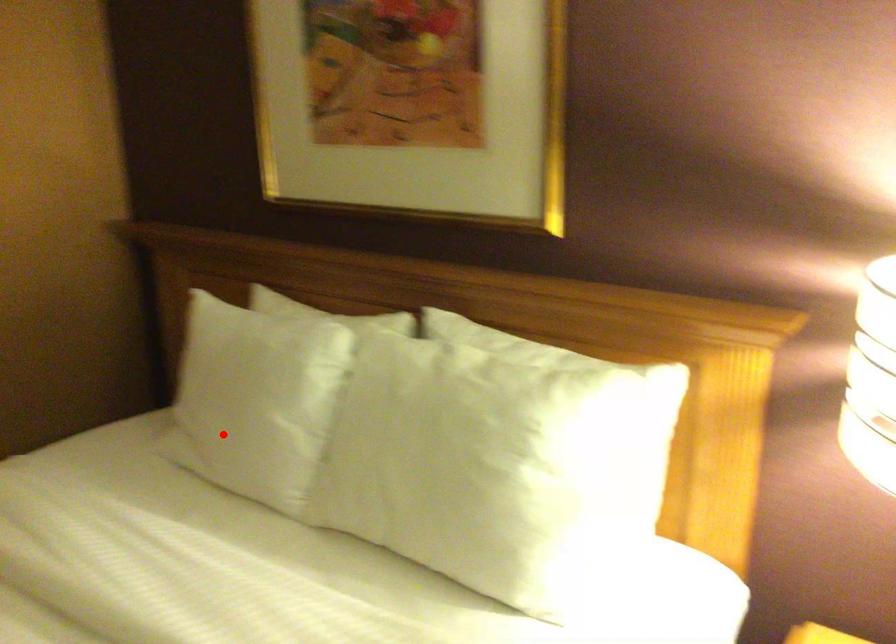
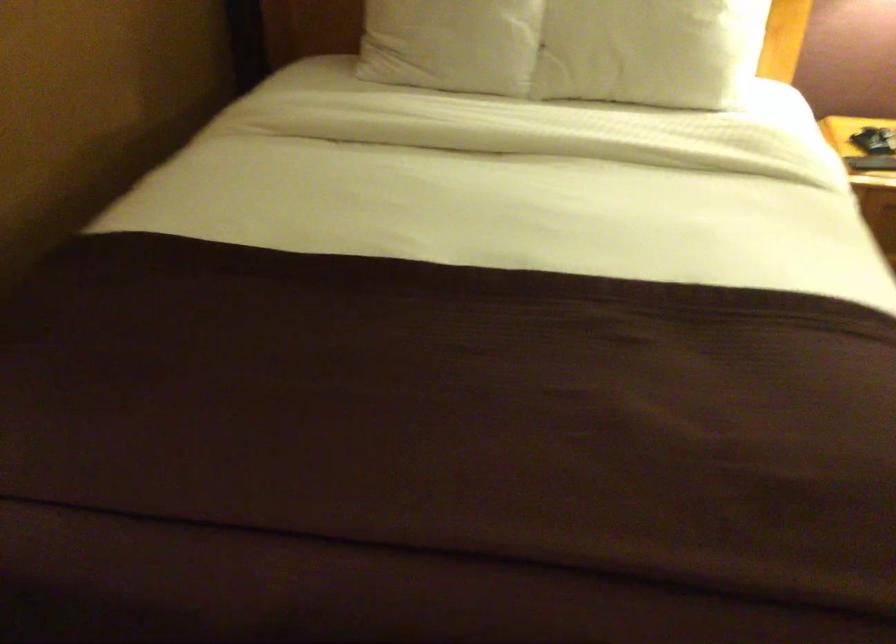
Question: A red point is marked in image1. In image2, is the corresponding 3D point closer to the camera or farther? Reply with the corresponding letter.

Choices:
 (A) The corresponding 3D point is closer.
 (B) The corresponding 3D point is farther.

Answer: (B)